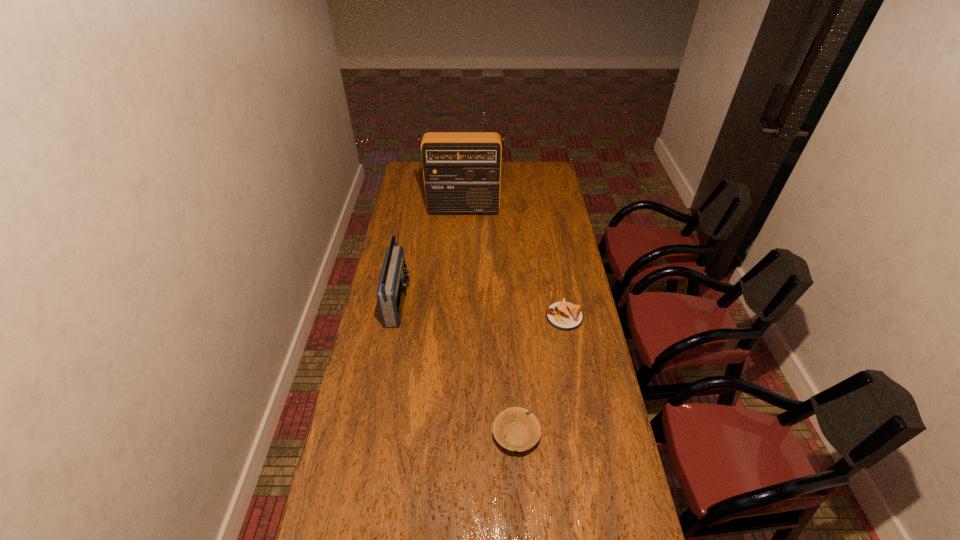
Identify the location of the right radio receiver. Image resolution: width=960 pixels, height=540 pixels. (462, 170).

Locate an element on the screen. This screenshot has width=960, height=540. the taller radio receiver is located at coordinates (462, 170).

Where is `the leftmost object`? This screenshot has width=960, height=540. the leftmost object is located at coordinates (392, 287).

At what (x,y) coordinates should I click in order to perform the action: click on the nearer radio receiver. Please return your answer as a coordinate pair (x, y). The image size is (960, 540). Looking at the image, I should click on (392, 287).

The width and height of the screenshot is (960, 540). What are the coordinates of `the nearest object` in the screenshot? It's located at (520, 427).

The height and width of the screenshot is (540, 960). What are the coordinates of `the rightmost object` in the screenshot? It's located at (563, 315).

Find the location of a particular element. sandwich is located at coordinates (563, 315).

The height and width of the screenshot is (540, 960). I want to click on free location located 0.270m on the front-facing side of the taller radio receiver, so click(461, 251).

Locate an element on the screen. The image size is (960, 540). vacant point located on the front panel of the nearer radio receiver is located at coordinates (455, 303).

In order to click on vacant space located 0.210m on the left of the nearest object in this screenshot , I will do tap(428, 435).